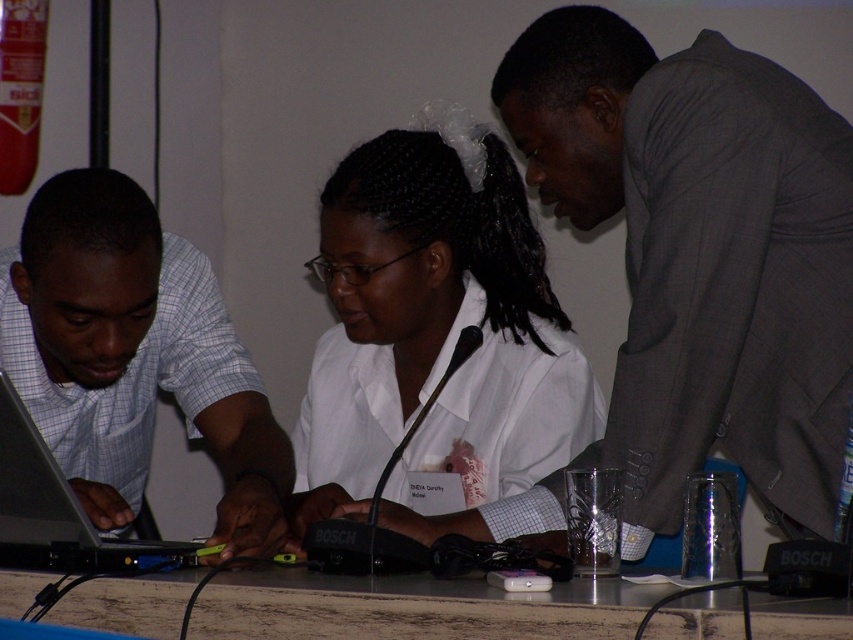
Question: Estimate the real-world distances between objects in this image. Which object is farther from the silver metallic laptop at left?

Choices:
 (A) gray suit at upper right
 (B) light blue checkered shirt at left
 (C) metallic gray table at center

Answer: (A)

Question: Can you confirm if light blue checkered shirt at left is wider than metallic gray table at center?

Choices:
 (A) yes
 (B) no

Answer: (B)

Question: Estimate the real-world distances between objects in this image. Which object is farther from the gray suit at upper right?

Choices:
 (A) white matte shirt at center
 (B) light blue checkered shirt at left
 (C) metallic gray table at center
 (D) silver metallic laptop at left

Answer: (D)

Question: Is white matte shirt at center thinner than metallic gray table at center?

Choices:
 (A) no
 (B) yes

Answer: (B)

Question: Considering the relative positions of metallic gray table at center and silver metallic laptop at left in the image provided, where is metallic gray table at center located with respect to silver metallic laptop at left?

Choices:
 (A) above
 (B) below

Answer: (B)

Question: Which of the following is the farthest from the observer?

Choices:
 (A) silver metallic laptop at left
 (B) white matte shirt at center
 (C) metallic gray table at center

Answer: (B)